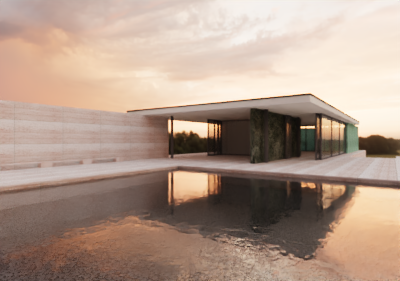
Where is `wooden wall`? This screenshot has width=400, height=281. wooden wall is located at coordinates (78, 133).